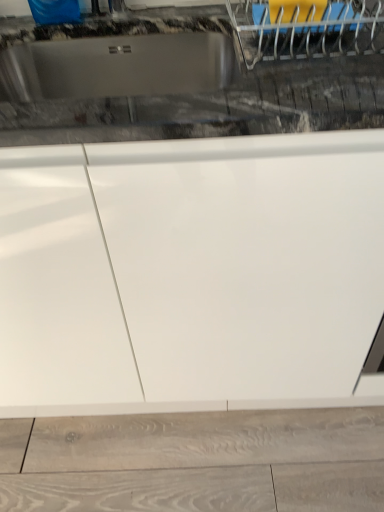
Where is `white glossy cabinet at center`? white glossy cabinet at center is located at coordinates tap(189, 272).

Measure the distance between point (x=227, y=199) and camera.

They are 25.55 inches apart.

This screenshot has width=384, height=512. Describe the element at coordinates (189, 272) in the screenshot. I see `white glossy cabinet at center` at that location.

At what (x,y) coordinates should I click in order to perform the action: click on white glossy cabinet at center. Please return your answer as a coordinate pair (x, y). This screenshot has height=512, width=384. Looking at the image, I should click on (189, 272).